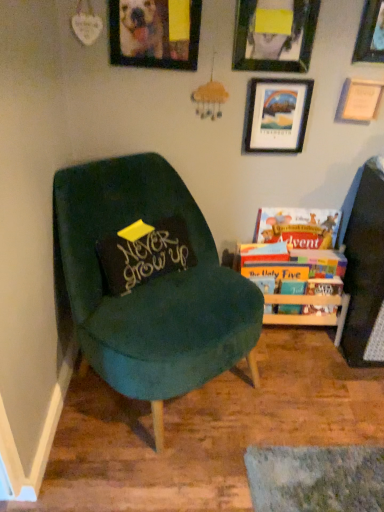
Question: In the image, is wooden picture frame at upper center, placed as the 5th picture frame when sorted from right to left, positioned in front of or behind hardcover books at right, which is the first book from bottom to top?

Choices:
 (A) behind
 (B) front

Answer: (B)

Question: From the image's perspective, relative to hardcover books at right, which is the first book from bottom to top, is wooden picture frame at upper center, placed as the 5th picture frame when sorted from right to left, above or below?

Choices:
 (A) above
 (B) below

Answer: (A)

Question: Estimate the real-world distances between objects in this image. Which object is closer to the hardcover book at right, the 2th book from the bottom?

Choices:
 (A) matte black picture frame at upper center, placed as the second picture frame when sorted from left to right
 (B) velvet green chair at left
 (C) wooden picture frame at upper right, the 3th picture frame viewed from the left
 (D) wooden picture frame at upper center, which is the first picture frame in left-to-right order
 (E) wooden picture frame at upper right, the 4th picture frame viewed from the left

Answer: (C)

Question: Which of these objects is positioned closest to the black velvet pillow at center?

Choices:
 (A) wooden picture frame at upper right, marked as the 5th picture frame in a left-to-right arrangement
 (B) matte black picture frame at upper center, placed as the second picture frame when sorted from left to right
 (C) wooden picture frame at upper right, the second picture frame positioned from the right
 (D) hardcover books at right, placed as the 2th book when sorted from top to bottom
 (E) hardcover book at right, the 2th book from the bottom

Answer: (D)